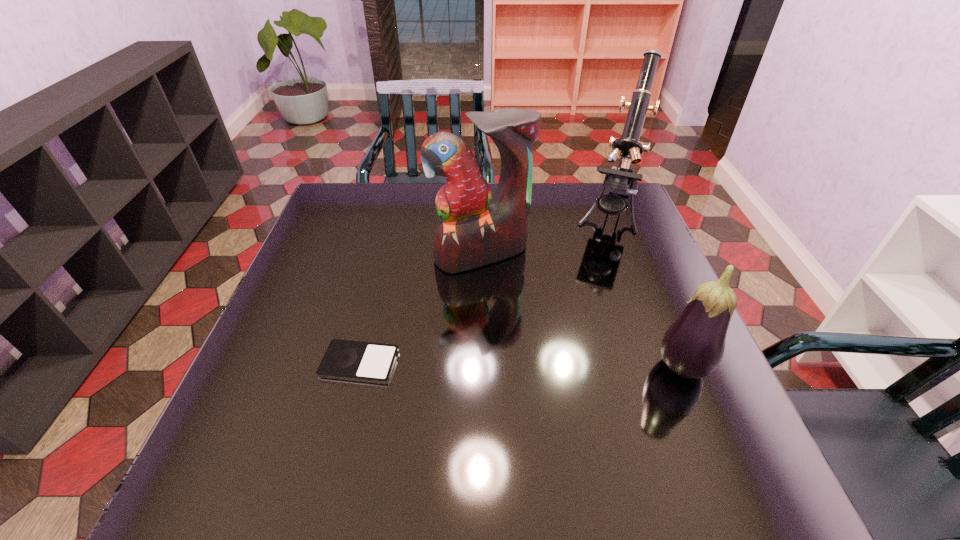
In order to click on free space located at the face of the third shortest object in this screenshot , I will do `click(540, 334)`.

Locate an element on the screen. Image resolution: width=960 pixels, height=540 pixels. vacant space located 0.390m through the eyepiece of the microscope is located at coordinates (570, 341).

Locate an element on the screen. free space located 0.140m through the eyepiece of the microscope is located at coordinates (594, 273).

The image size is (960, 540). What are the coordinates of `vacant space located through the eyepiece of the microscope` in the screenshot? It's located at (590, 283).

Locate an element on the screen. object that is at the far edge is located at coordinates (621, 177).

Locate an element on the screen. This screenshot has height=540, width=960. object at the left edge is located at coordinates (350, 360).

Locate an element on the screen. eggplant at the right edge is located at coordinates (693, 346).

The image size is (960, 540). What are the coordinates of `microscope present at the right edge` in the screenshot? It's located at (621, 177).

Where is `object that is at the far right corner`? The width and height of the screenshot is (960, 540). object that is at the far right corner is located at coordinates (621, 177).

The width and height of the screenshot is (960, 540). Identify the location of free region at the far edge of the desktop. (388, 224).